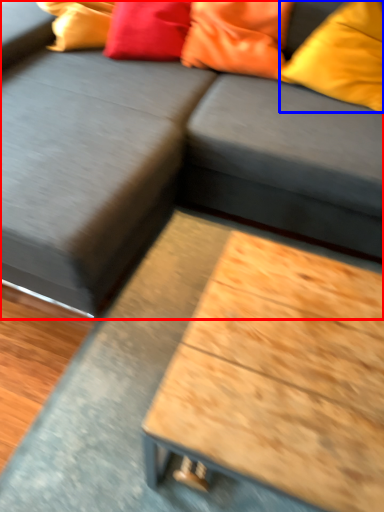
Question: Which point is closer to the camera, studio couch (highlighted by a red box) or pillow (highlighted by a blue box)?

Choices:
 (A) studio couch
 (B) pillow

Answer: (A)